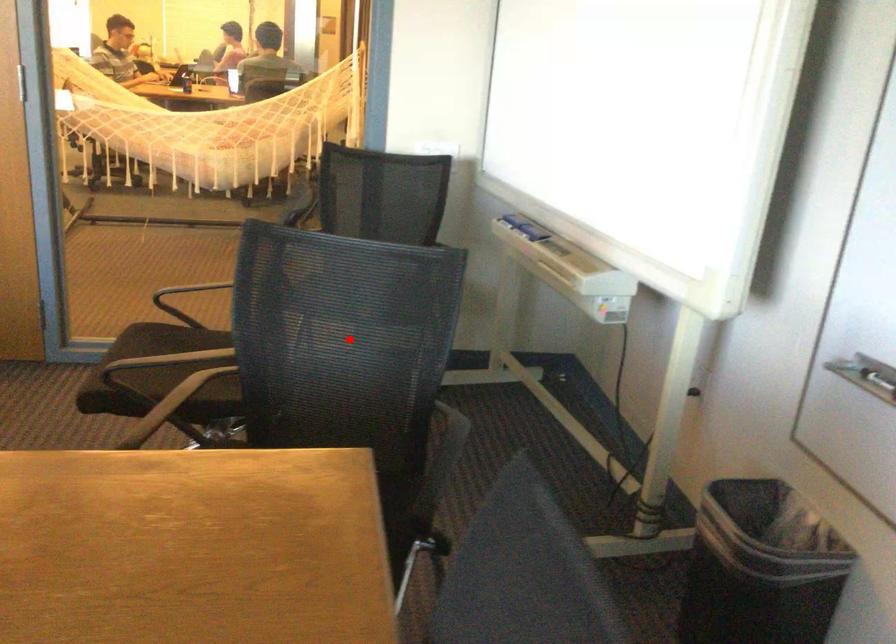
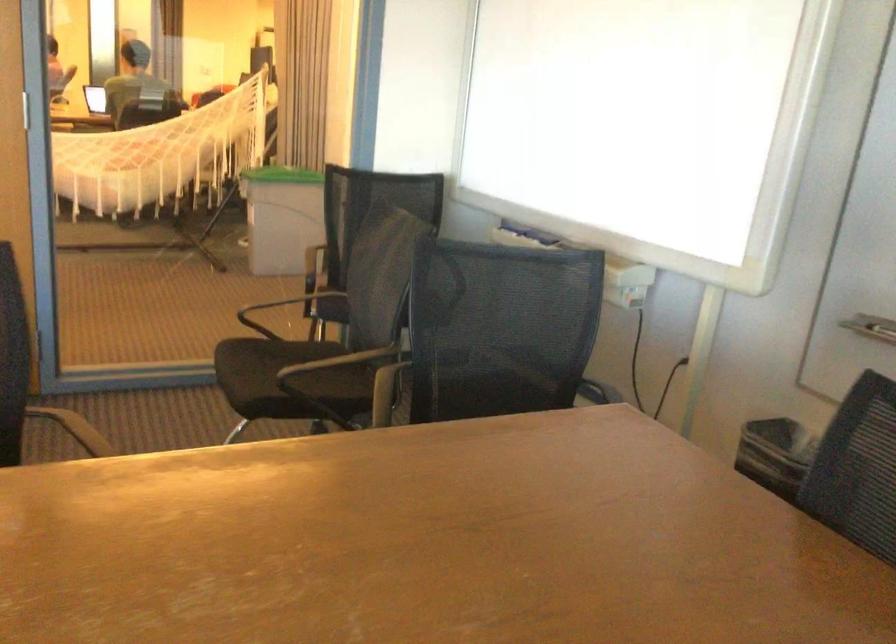
Question: A red point is marked in image1. In image2, is the corresponding 3D point closer to the camera or farther? Reply with the corresponding letter.

Choices:
 (A) The corresponding 3D point is closer.
 (B) The corresponding 3D point is farther.

Answer: (B)